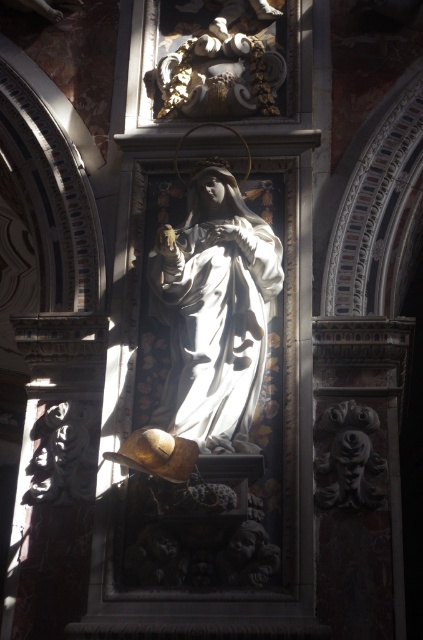
Question: Is matte white statue at center positioned before gold textured statue at upper center?

Choices:
 (A) yes
 (B) no

Answer: (A)

Question: Among these points, which one is farthest from the camera?

Choices:
 (A) pyautogui.click(x=250, y=308)
 (B) pyautogui.click(x=335, y=419)
 (C) pyautogui.click(x=170, y=38)

Answer: (C)

Question: Which point is farther to the camera?

Choices:
 (A) matte white statue at center
 (B) carved stone face at lower right

Answer: (B)

Question: In this image, where is matte white statue at center located relative to gold textured statue at upper center?

Choices:
 (A) below
 (B) above

Answer: (A)

Question: Is gold textured statue at upper center wider than carved stone face at lower right?

Choices:
 (A) no
 (B) yes

Answer: (B)

Question: Based on their relative distances, which object is nearer to the gold textured statue at upper center?

Choices:
 (A) carved stone face at lower right
 (B) matte white statue at center

Answer: (B)